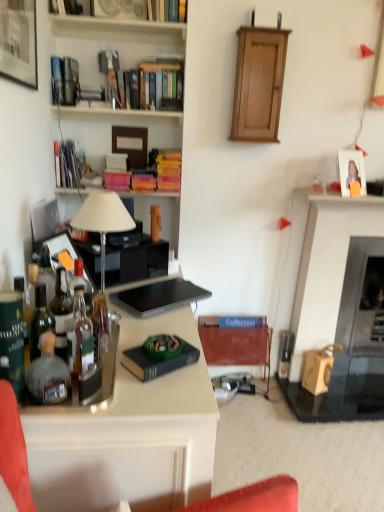
The image size is (384, 512). Find the location of `empty space that is ontop of wooden bookshelf at upper center, which ranks as the first shelf in top-to-bottom order (from a real-world perspective)`. empty space that is ontop of wooden bookshelf at upper center, which ranks as the first shelf in top-to-bottom order (from a real-world perspective) is located at coordinates (114, 20).